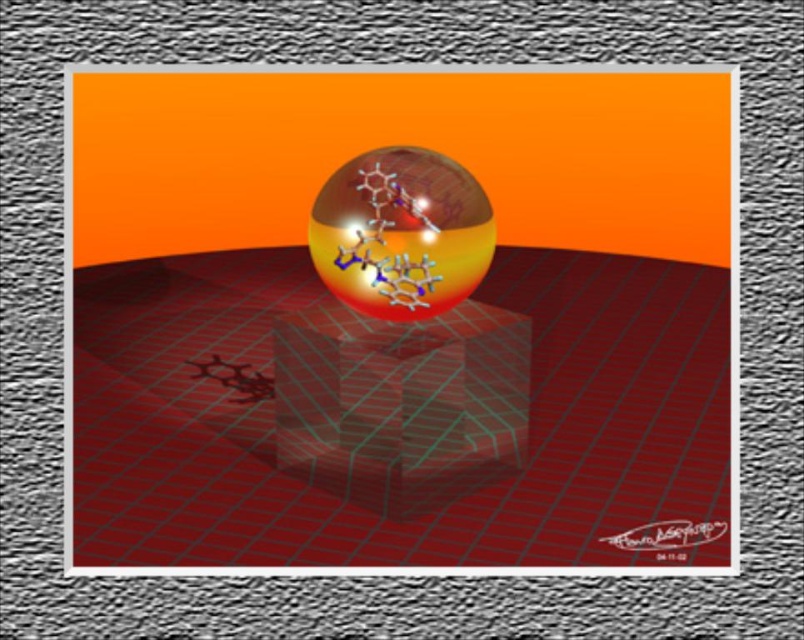
You are an engineer analyzing the positioning of objects in the digital artwork. The central spherical object with a gradient from yellow to red has a molecular structure above it. There is also a transparent glass cube at center. Based on their positions, which object is closer to the bottom edge of the image?

The transparent glass cube at center is located at point (x=396, y=420), which places it closer to the bottom edge compared to the central spherical object with a gradient from yellow to red. Therefore, the transparent glass cube at center is closer to the bottom edge.